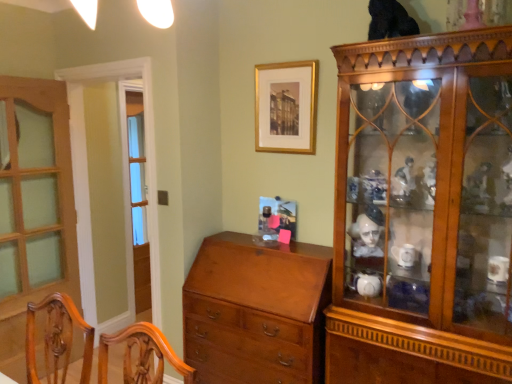
Question: Is gold framed picture at upper center far from black fur cat at upper center?

Choices:
 (A) yes
 (B) no

Answer: (B)

Question: Is gold framed picture at upper center thinner than black fur cat at upper center?

Choices:
 (A) no
 (B) yes

Answer: (B)

Question: Can you confirm if gold framed picture at upper center is wider than black fur cat at upper center?

Choices:
 (A) no
 (B) yes

Answer: (A)

Question: Is gold framed picture at upper center shorter than black fur cat at upper center?

Choices:
 (A) no
 (B) yes

Answer: (A)

Question: Would you say black fur cat at upper center is part of gold framed picture at upper center's contents?

Choices:
 (A) no
 (B) yes

Answer: (A)

Question: Is shiny brown chest of drawers at center spatially inside mahogany wood chair at lower left, or outside of it?

Choices:
 (A) inside
 (B) outside

Answer: (B)

Question: Considering the positions of point (223, 281) and point (49, 347), is point (223, 281) closer or farther from the camera than point (49, 347)?

Choices:
 (A) closer
 (B) farther

Answer: (B)

Question: Would you say shiny brown chest of drawers at center is to the left or to the right of mahogany wood chair at lower left in the picture?

Choices:
 (A) right
 (B) left

Answer: (A)

Question: Is shiny brown chest of drawers at center in front of or behind mahogany wood chair at lower left in the image?

Choices:
 (A) front
 (B) behind

Answer: (B)

Question: Is gold framed picture at upper center wider or thinner than shiny brown chest of drawers at center?

Choices:
 (A) thin
 (B) wide

Answer: (A)

Question: In the image, is gold framed picture at upper center positioned in front of or behind shiny brown chest of drawers at center?

Choices:
 (A) behind
 (B) front

Answer: (A)

Question: From the image's perspective, is gold framed picture at upper center located above or below shiny brown chest of drawers at center?

Choices:
 (A) below
 (B) above

Answer: (B)

Question: From a real-world perspective, is gold framed picture at upper center positioned above or below shiny brown chest of drawers at center?

Choices:
 (A) above
 (B) below

Answer: (A)

Question: Based on their sizes in the image, would you say shiny brown chest of drawers at center is bigger or smaller than clear glass screen door at left?

Choices:
 (A) big
 (B) small

Answer: (A)

Question: Is shiny brown chest of drawers at center in front of or behind clear glass screen door at left in the image?

Choices:
 (A) front
 (B) behind

Answer: (A)